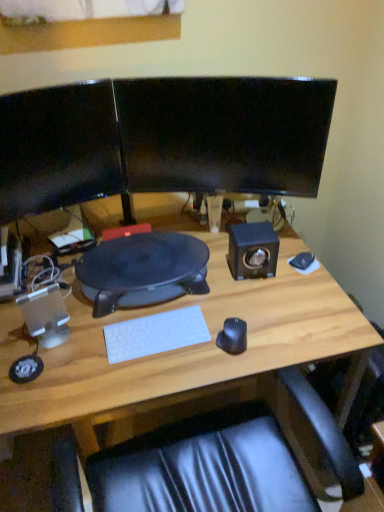
The width and height of the screenshot is (384, 512). I want to click on vacant position to the left of white matte mousepad at right, so click(x=258, y=275).